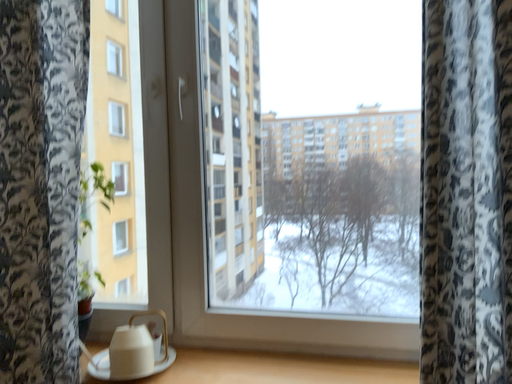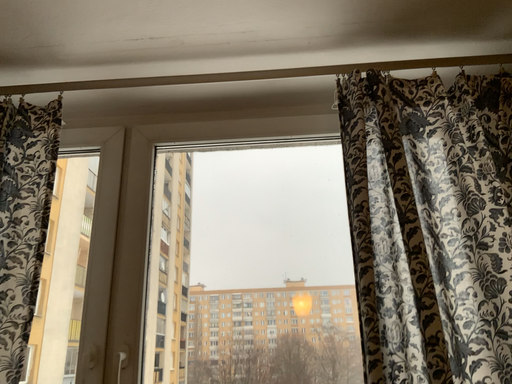
Question: Which way did the camera rotate in the video?

Choices:
 (A) rotated upward
 (B) rotated downward

Answer: (A)